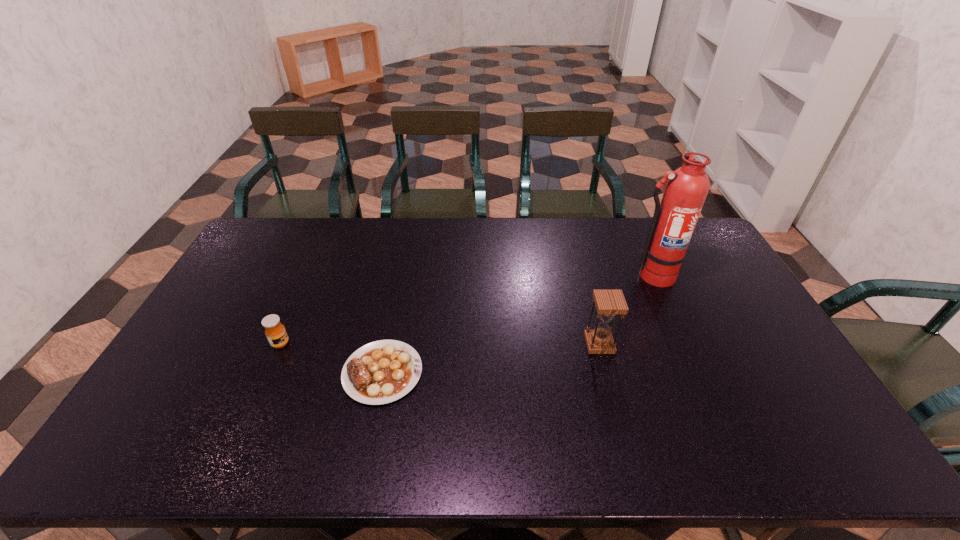
Locate an element on the screen. free area in between the rightmost object and the second shortest object is located at coordinates (467, 309).

At what (x,y) coordinates should I click in order to perform the action: click on vacant point located between the leftmost object and the tallest object. Please return your answer as a coordinate pair (x, y). The height and width of the screenshot is (540, 960). Looking at the image, I should click on (467, 309).

What are the coordinates of `free point between the farthest object and the honey` in the screenshot? It's located at (467, 309).

This screenshot has height=540, width=960. Identify the location of vacant area that lies between the third shortest object and the shortest object. (491, 358).

Where is `vacant area between the second object from right to left and the shortest object`? vacant area between the second object from right to left and the shortest object is located at coordinates (491, 358).

Where is `free spot between the hourglass and the shortest object`? This screenshot has width=960, height=540. free spot between the hourglass and the shortest object is located at coordinates (491, 358).

Point out which object is positioned as the second nearest to the honey. Please provide its 2D coordinates. Your answer should be formatted as a tuple, i.e. [(x, y)], where the tuple contains the x and y coordinates of a point satisfying the conditions above.

[(608, 303)]

Point out which object is positioned as the nearest to the steak. Please provide its 2D coordinates. Your answer should be formatted as a tuple, i.e. [(x, y)], where the tuple contains the x and y coordinates of a point satisfying the conditions above.

[(275, 331)]

The image size is (960, 540). I want to click on free point that satisfies the following two spatial constraints: 1. on the front-facing side of the honey; 2. on the back side of the second tallest object, so click(280, 344).

Where is `vacant position in the image that satisfies the following two spatial constraints: 1. on the front-facing side of the honey; 2. on the left side of the third object from right to left`? vacant position in the image that satisfies the following two spatial constraints: 1. on the front-facing side of the honey; 2. on the left side of the third object from right to left is located at coordinates (268, 373).